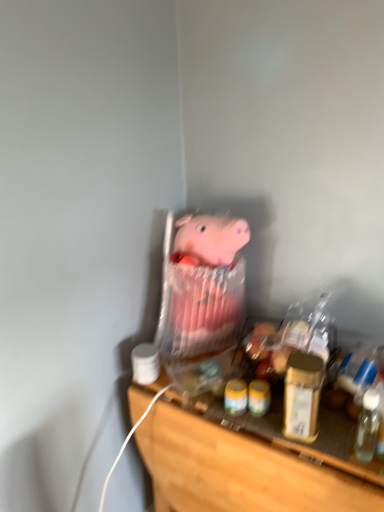
Question: Is point (306, 426) positioned closer to the camera than point (210, 316)?

Choices:
 (A) farther
 (B) closer

Answer: (B)

Question: From the image's perspective, is gold metallic jar at right above or below pink fabric pig at center?

Choices:
 (A) below
 (B) above

Answer: (A)

Question: Estimate the real-world distances between objects in this image. Which object is closer to the transparent plastic bottle at right?

Choices:
 (A) wooden shelf at lower center
 (B) gold metallic jar at right
 (C) pink fabric pig at center

Answer: (B)

Question: Which object is the closest to the pink fabric pig at center?

Choices:
 (A) gold metallic jar at right
 (B) wooden shelf at lower center
 (C) transparent plastic bottle at right

Answer: (B)